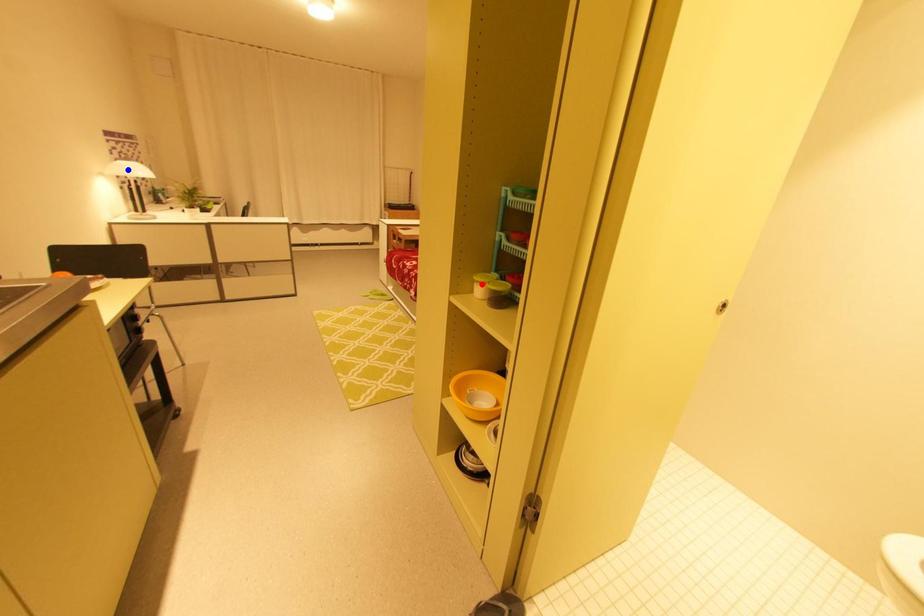
Question: Two points are marked on the image. Which point is closer to the camera?

Choices:
 (A) Blue point is closer.
 (B) Red point is closer.

Answer: (B)